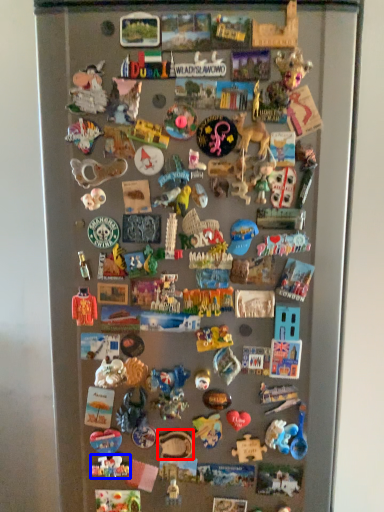
Question: Among these objects, which one is nearest to the camera, toy (highlighted by a red box) or toy (highlighted by a blue box)?

Choices:
 (A) toy
 (B) toy

Answer: (A)